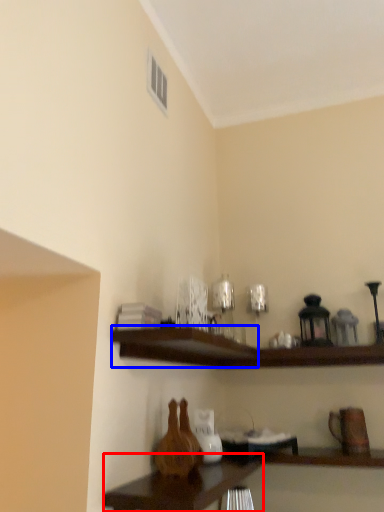
Question: Which point is closer to the camera, table (highlighted by a red box) or shelf (highlighted by a blue box)?

Choices:
 (A) table
 (B) shelf

Answer: (A)